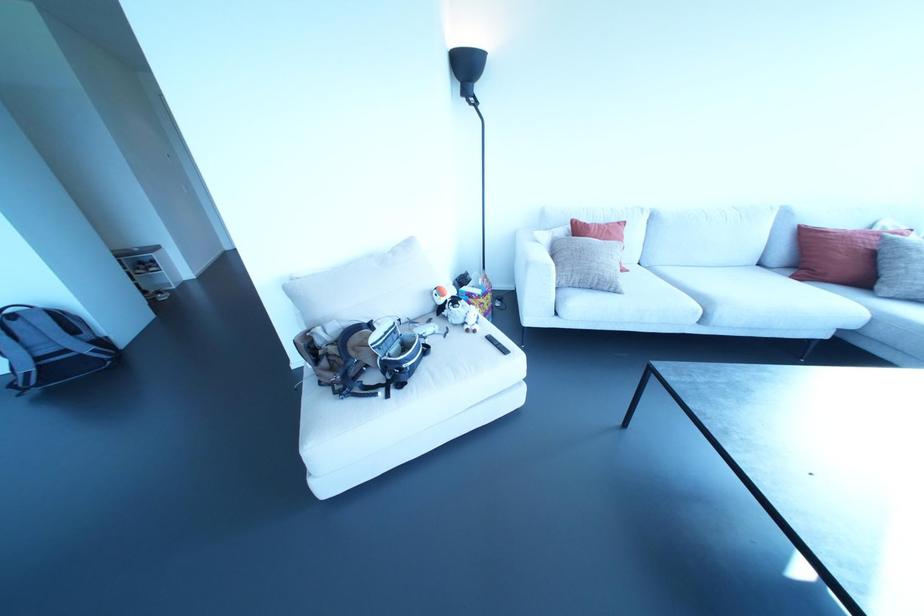
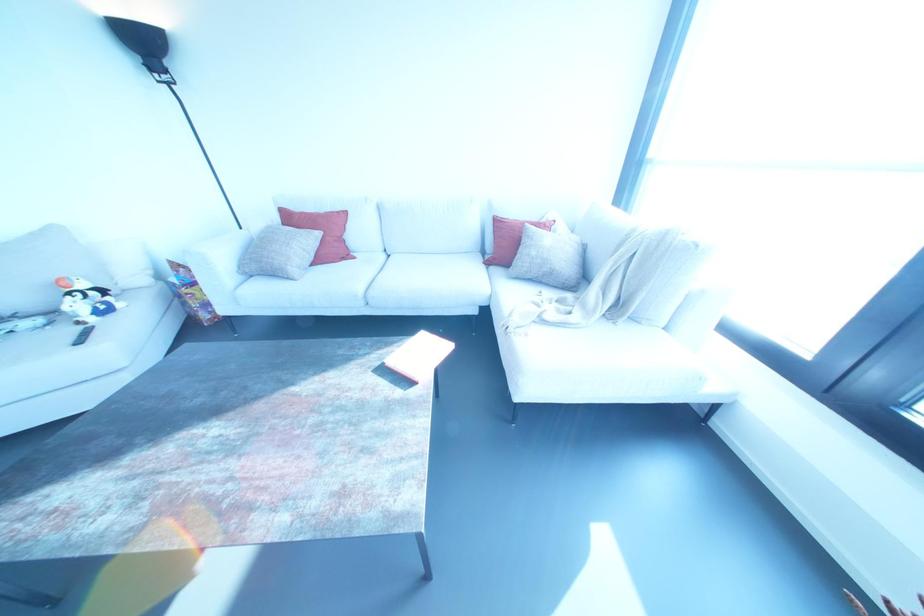
In the second image, find the point that corresponds to [467,330] in the first image.

(78, 322)